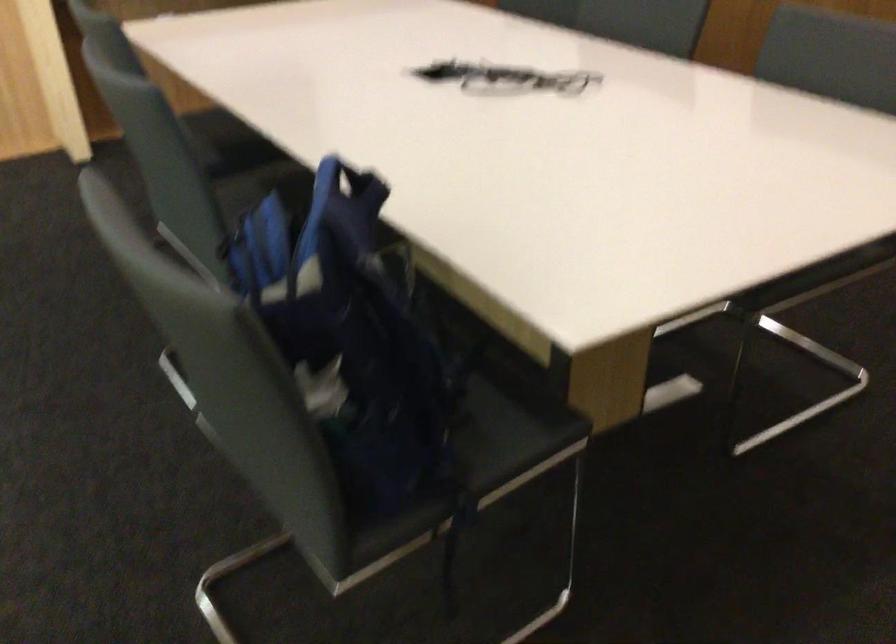
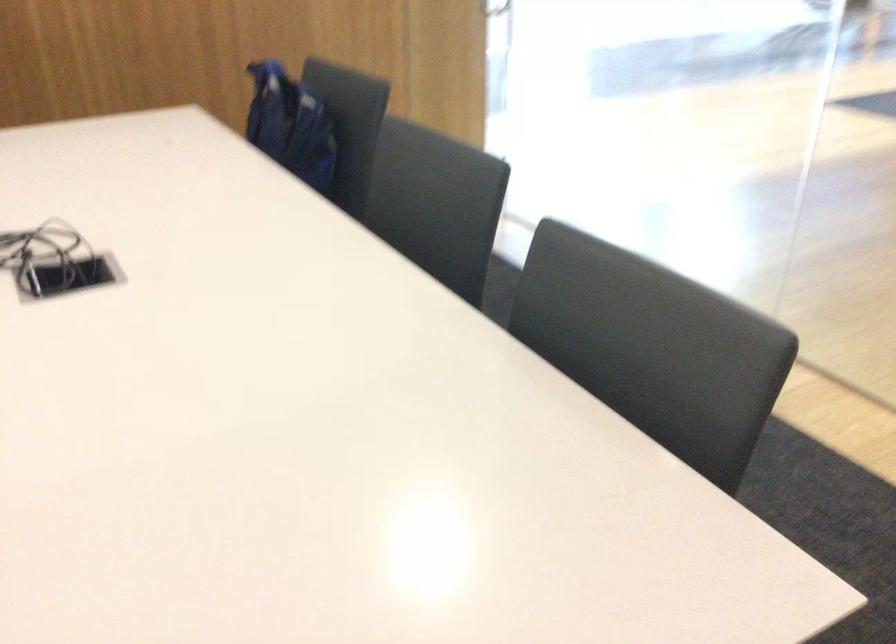
Question: I am providing you with two images of the same scene from different viewpoints. Please identify which objects are invisible in image2.

Choices:
 (A) yellow glue stick
 (B) blue backpack
 (C) chair sitting surface
 (D) black phone

Answer: (C)